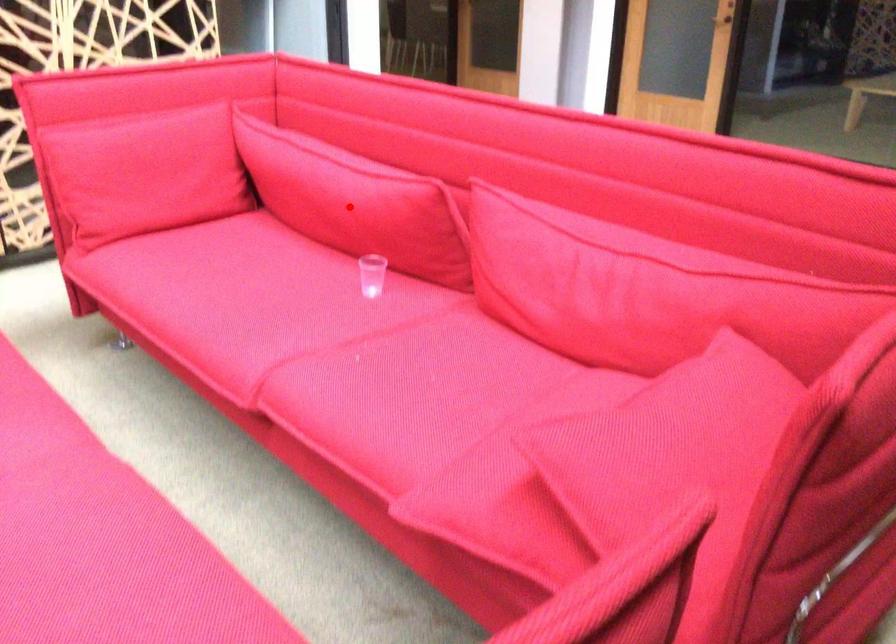
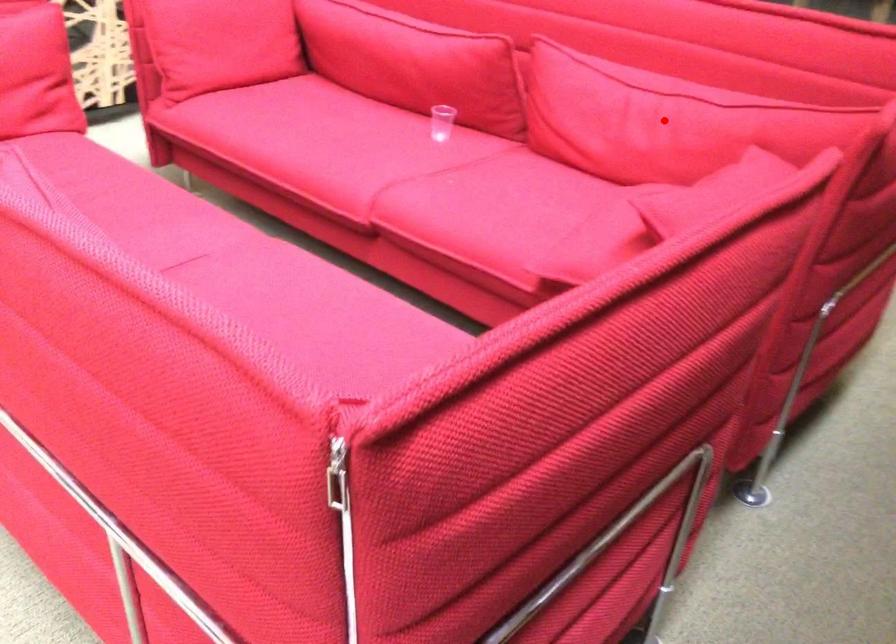
I am providing you with two images of the same scene from different viewpoints. A red point is marked on the first image and another point is marked on the second image. Is the marked point in image1 the same physical position as the marked point in image2?

No